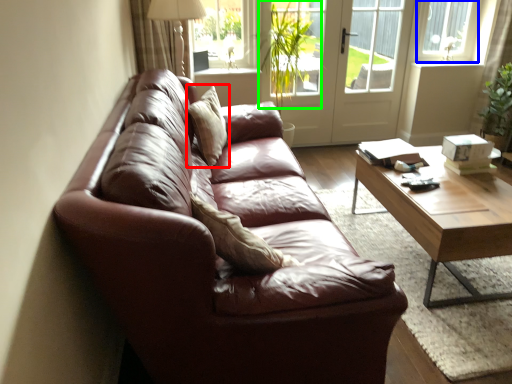
Question: Considering the real-world distances, which object is closest to pillow (highlighted by a red box)? window frame (highlighted by a blue box) or plant (highlighted by a green box).

Choices:
 (A) window frame
 (B) plant

Answer: (B)